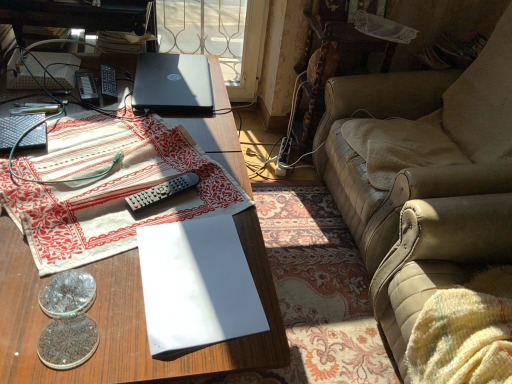
Where is `vacant space in front of black plastic remote control at upper left, which is counted as the second remote control, starting from the bottom`? Image resolution: width=512 pixels, height=384 pixels. vacant space in front of black plastic remote control at upper left, which is counted as the second remote control, starting from the bottom is located at coordinates tap(69, 117).